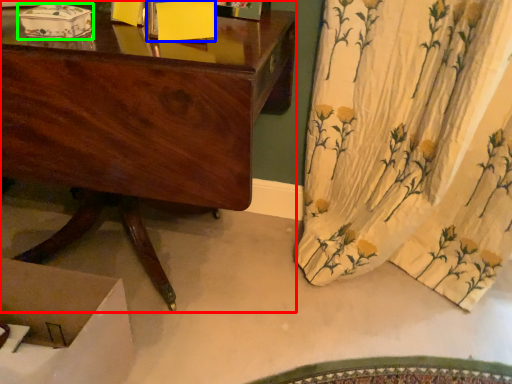
Question: Which is farther away from desk (highlighted by a red box)? box (highlighted by a blue box) or box (highlighted by a green box)?

Choices:
 (A) box
 (B) box

Answer: (B)